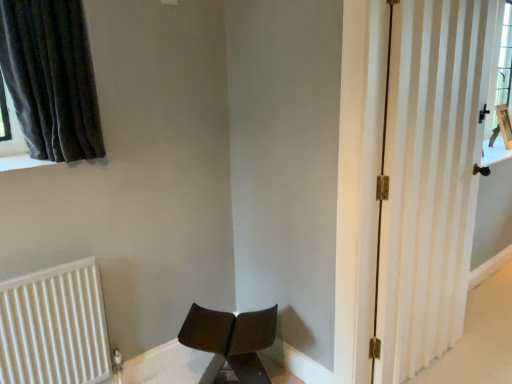
Image resolution: width=512 pixels, height=384 pixels. I want to click on dark grey fabric curtain at upper left, so click(x=51, y=78).

What is the approximate height of white striped door at right?

It is 1.77 meters.

Describe the element at coordinates (231, 342) in the screenshot. I see `matte brown chair at lower center` at that location.

Where is `dark grey fabric curtain at upper left`? The height and width of the screenshot is (384, 512). dark grey fabric curtain at upper left is located at coordinates (51, 78).

Is white striped door at right positioned far away from matte brown chair at lower center?

No, white striped door at right is not far away from matte brown chair at lower center.

Between white striped door at right and matte brown chair at lower center, which one appears on the left side from the viewer's perspective?

matte brown chair at lower center.

Between white striped door at right and matte brown chair at lower center, which one has larger size?

With larger size is white striped door at right.

From a real-world perspective, is white striped door at right physically located above or below matte brown chair at lower center?

Clearly, from a real-world perspective, white striped door at right is above matte brown chair at lower center.

What's the angular difference between white ribbed radiator at lower left and dark grey fabric curtain at upper left's facing directions?

white ribbed radiator at lower left and dark grey fabric curtain at upper left are facing 4.09 degrees away from each other.

From a real-world perspective, is white ribbed radiator at lower left positioned above or below dark grey fabric curtain at upper left?

From a real-world perspective, white ribbed radiator at lower left is physically below dark grey fabric curtain at upper left.

Can you confirm if white ribbed radiator at lower left is shorter than dark grey fabric curtain at upper left?

No.

Looking at the image, does white ribbed radiator at lower left seem bigger or smaller compared to dark grey fabric curtain at upper left?

Considering their sizes, white ribbed radiator at lower left takes up less space than dark grey fabric curtain at upper left.

Considering the positions of objects white ribbed radiator at lower left and white striped door at right in the image provided, who is more to the right, white ribbed radiator at lower left or white striped door at right?

white striped door at right is more to the right.

Would you say white ribbed radiator at lower left is outside white striped door at right?

That's correct, white ribbed radiator at lower left is outside of white striped door at right.

Who is more distant, white ribbed radiator at lower left or white striped door at right?

Positioned behind is white ribbed radiator at lower left.

Is white striped door at right positioned behind white ribbed radiator at lower left?

No, the depth of white striped door at right is less than that of white ribbed radiator at lower left.

Is white striped door at right turned away from white ribbed radiator at lower left?

No, white striped door at right's orientation is not away from white ribbed radiator at lower left.

Do you think white striped door at right is within white ribbed radiator at lower left, or outside of it?

white striped door at right is not enclosed by white ribbed radiator at lower left.

The height and width of the screenshot is (384, 512). I want to click on door that is above the white ribbed radiator at lower left (from a real-world perspective), so click(430, 177).

Which is more to the left, matte brown chair at lower center or dark grey fabric curtain at upper left?

dark grey fabric curtain at upper left.

Is point (233, 349) behind point (71, 3)?

That is True.

Find the location of a particular element. curtain positioned vertically above the matte brown chair at lower center (from a real-world perspective) is located at coordinates (51, 78).

Is white ribbed radiator at lower left in contact with matte brown chair at lower center?

No, white ribbed radiator at lower left is not touching matte brown chair at lower center.

Which is closer, (x=9, y=356) or (x=251, y=334)?

Clearly, point (x=9, y=356) is closer to the camera than point (x=251, y=334).

Is white ribbed radiator at lower left bigger than matte brown chair at lower center?

Incorrect, white ribbed radiator at lower left is not larger than matte brown chair at lower center.

Is white ribbed radiator at lower left outside of matte brown chair at lower center?

Yes, white ribbed radiator at lower left is located beyond the bounds of matte brown chair at lower center.

Considering the positions of point (69, 64) and point (222, 346), is point (69, 64) closer or farther from the camera than point (222, 346)?

Clearly, point (69, 64) is closer to the camera than point (222, 346).

How far apart are dark grey fabric curtain at upper left and matte brown chair at lower center?

The distance of dark grey fabric curtain at upper left from matte brown chair at lower center is 1.15 meters.

Does dark grey fabric curtain at upper left turn towards matte brown chair at lower center?

No, dark grey fabric curtain at upper left does not turn towards matte brown chair at lower center.

Is dark grey fabric curtain at upper left positioned far away from matte brown chair at lower center?

Indeed, dark grey fabric curtain at upper left is not near matte brown chair at lower center.

Where is `door lying above the matte brown chair at lower center (from the image's perspective)`? door lying above the matte brown chair at lower center (from the image's perspective) is located at coordinates (430, 177).

Locate an element on the screen. radiator that is behind the dark grey fabric curtain at upper left is located at coordinates (54, 327).

Estimate the real-world distances between objects in this image. Which object is further from white ribbed radiator at lower left, dark grey fabric curtain at upper left or white striped door at right?

white striped door at right is further to white ribbed radiator at lower left.

When comparing their distances from white striped door at right, does white ribbed radiator at lower left or dark grey fabric curtain at upper left seem further?

white ribbed radiator at lower left is positioned further to the anchor white striped door at right.

Which object lies further to the anchor point matte brown chair at lower center, dark grey fabric curtain at upper left or white ribbed radiator at lower left?

dark grey fabric curtain at upper left.

Considering their positions, is matte brown chair at lower center positioned closer to white ribbed radiator at lower left than white striped door at right?

The object closer to white ribbed radiator at lower left is matte brown chair at lower center.

Based on their spatial positions, is white striped door at right or matte brown chair at lower center closer to dark grey fabric curtain at upper left?

matte brown chair at lower center.

Considering their positions, is matte brown chair at lower center positioned further to white striped door at right than dark grey fabric curtain at upper left?

Result: dark grey fabric curtain at upper left is further to white striped door at right.

In the scene shown: Estimate the real-world distances between objects in this image. Which object is closer to dark grey fabric curtain at upper left, white striped door at right or white ribbed radiator at lower left?

white ribbed radiator at lower left.

Looking at the image, which one is located closer to white striped door at right, dark grey fabric curtain at upper left or white ribbed radiator at lower left?

Based on the image, dark grey fabric curtain at upper left appears to be nearer to white striped door at right.

This screenshot has width=512, height=384. I want to click on chair between white ribbed radiator at lower left and white striped door at right from left to right, so click(231, 342).

At what (x,y) coordinates should I click in order to perform the action: click on radiator situated between dark grey fabric curtain at upper left and white striped door at right from left to right. Please return your answer as a coordinate pair (x, y). The image size is (512, 384). Looking at the image, I should click on [x=54, y=327].

I want to click on chair between dark grey fabric curtain at upper left and white striped door at right, so click(x=231, y=342).

Where is `radiator between dark grey fabric curtain at upper left and matte brown chair at lower center in the up-down direction`? The image size is (512, 384). radiator between dark grey fabric curtain at upper left and matte brown chair at lower center in the up-down direction is located at coordinates (54, 327).